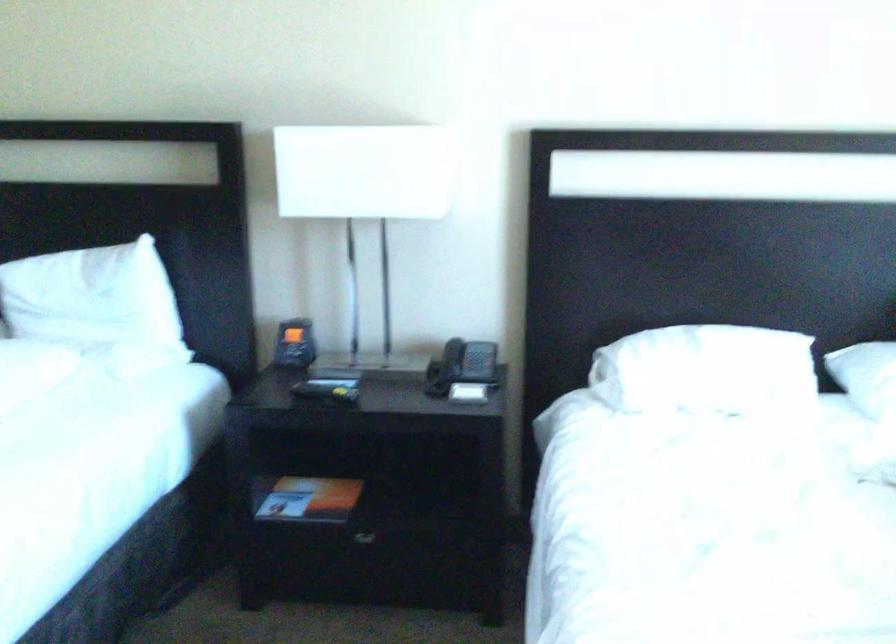
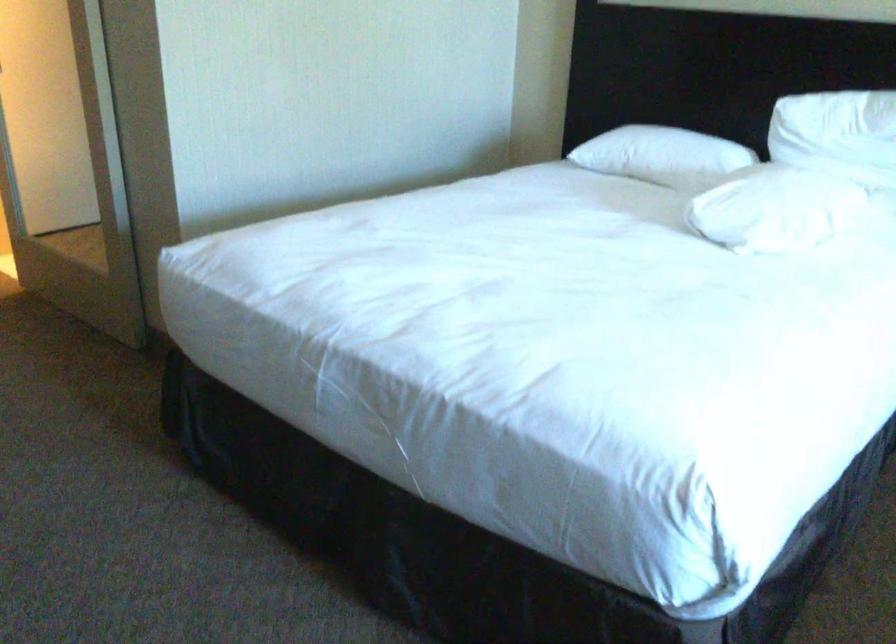
Question: How did the camera likely rotate?

Choices:
 (A) Left
 (B) Right
 (C) Up
 (D) Down

Answer: (A)